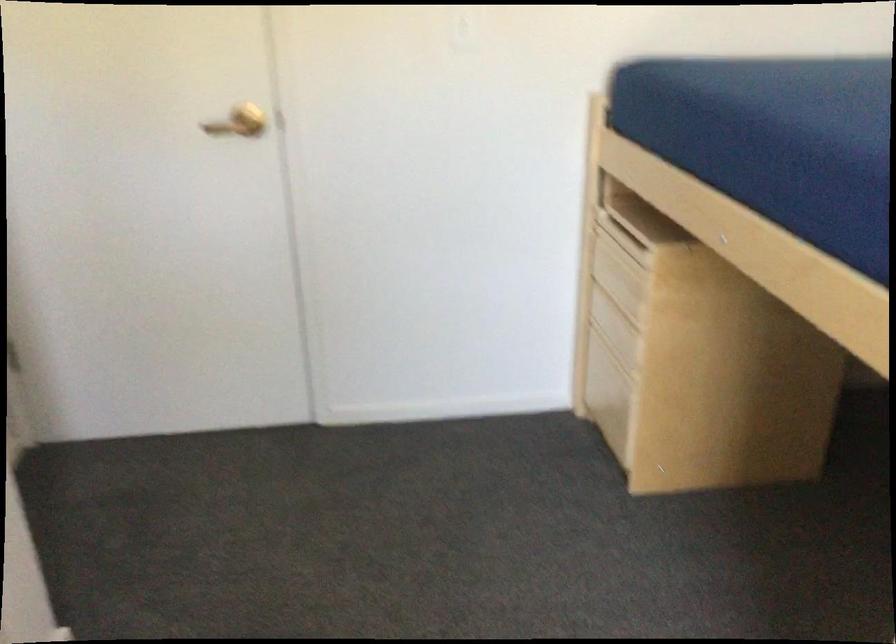
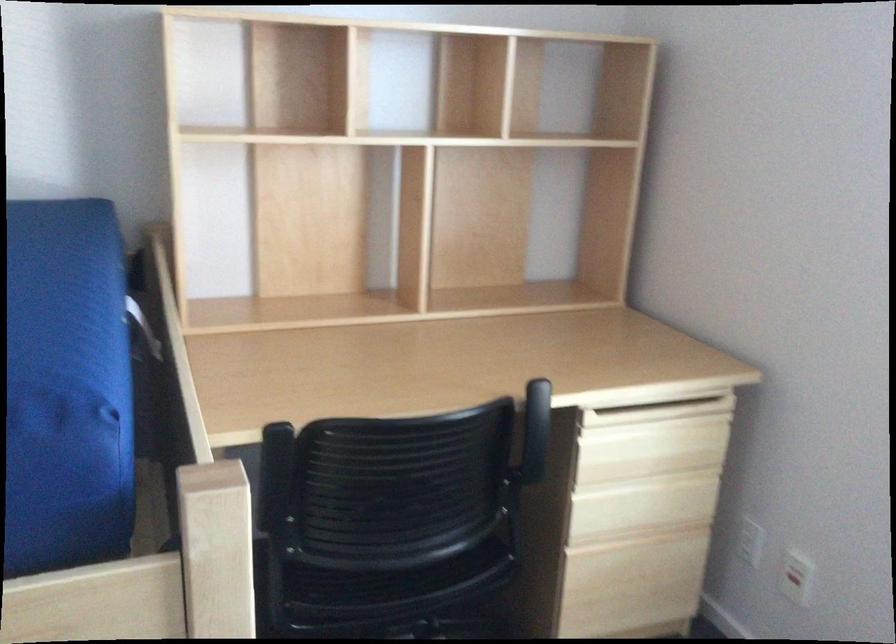
The first image is from the beginning of the video and the second image is from the end. How did the camera likely rotate when shooting the video?

The rotation direction of the camera is right-down.